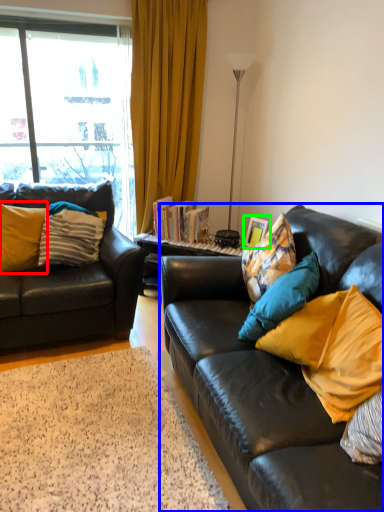
Question: Which is nearer to the pillow (highlighted by a red box)? studio couch (highlighted by a blue box) or picture frame (highlighted by a green box).

Choices:
 (A) studio couch
 (B) picture frame

Answer: (A)